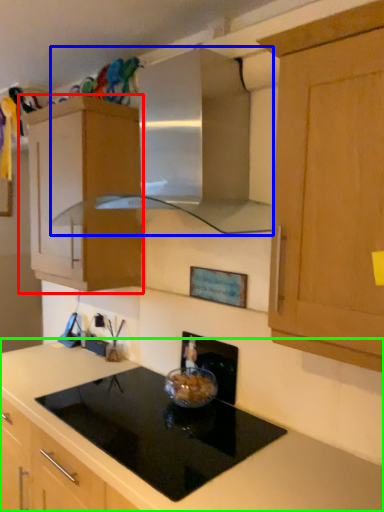
Question: Which object is positioned farthest from cabinetry (highlighted by a red box)? Select from vent (highlighted by a blue box) and countertop (highlighted by a green box).

Choices:
 (A) vent
 (B) countertop

Answer: (B)